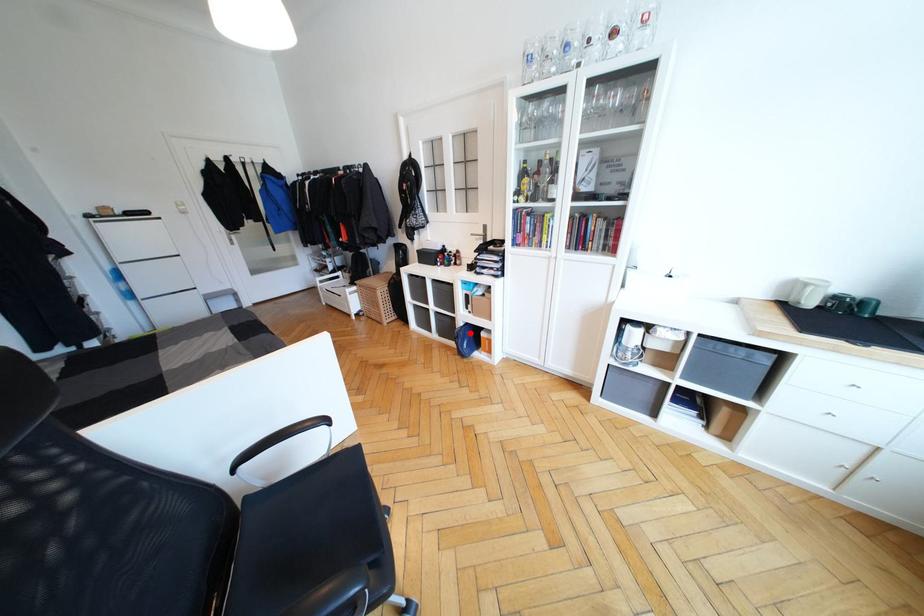
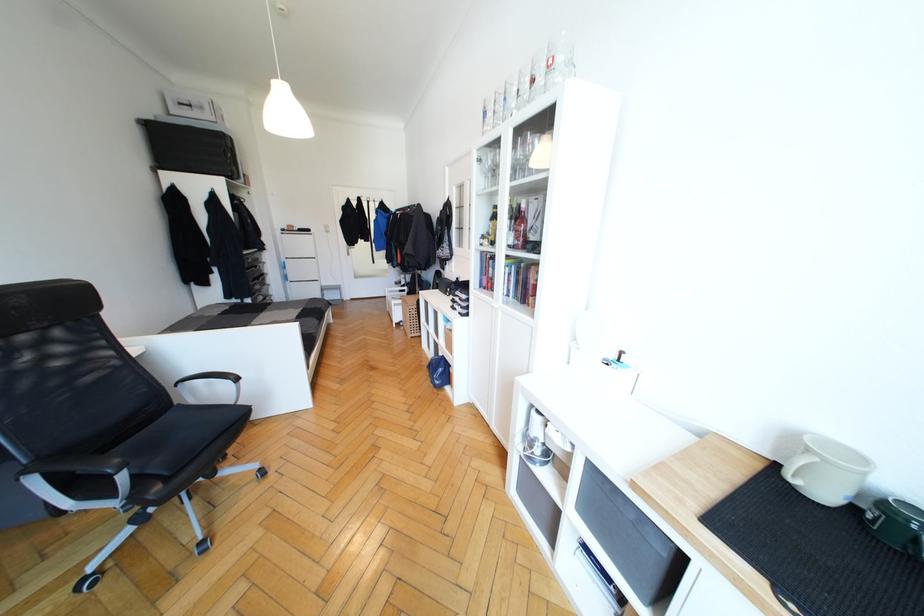
Find the pixel in the second image that matches the highlighted location in the first image.

(445, 363)